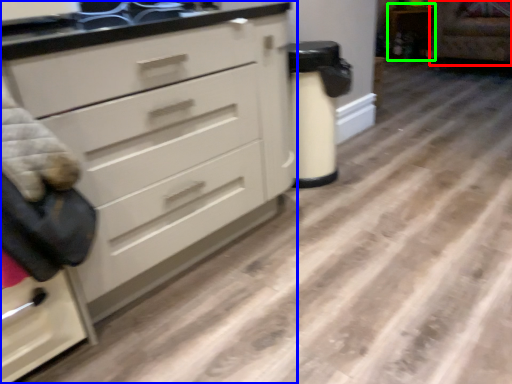
Question: Which object is positioned farthest from armchair (highlighted by a red box)? Select from chest of drawers (highlighted by a blue box) and cabinetry (highlighted by a green box).

Choices:
 (A) chest of drawers
 (B) cabinetry

Answer: (A)